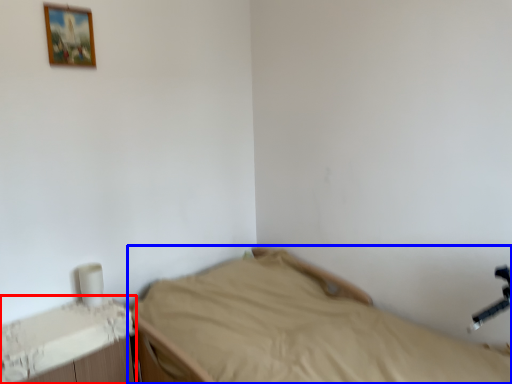
Question: Which object appears closest to the camera in this image, changing table (highlighted by a red box) or bed (highlighted by a blue box)?

Choices:
 (A) changing table
 (B) bed

Answer: (B)